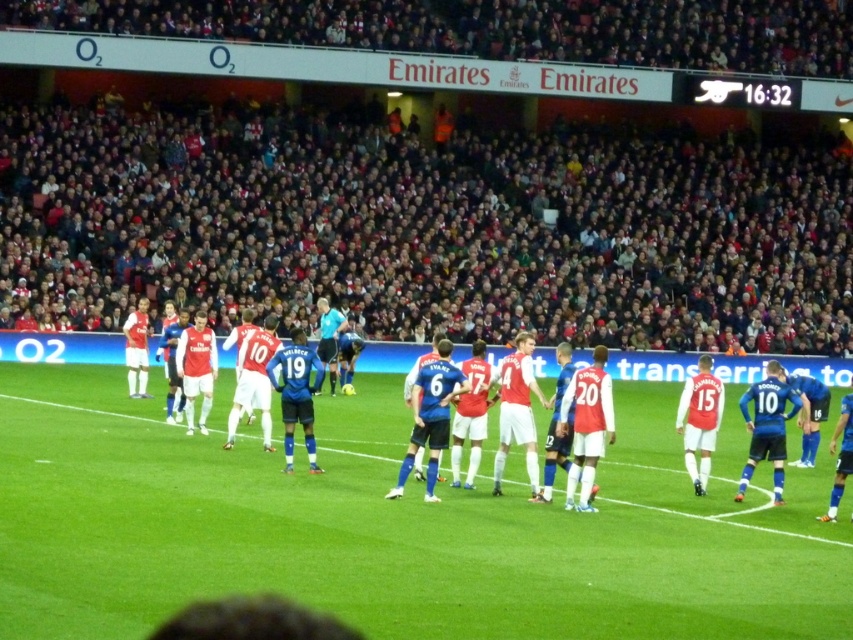
Question: Which of the following is the farthest from the observer?

Choices:
 (A) white jersey at center
 (B) green grass football field at center

Answer: (A)

Question: Is green grass football field at center behind white jersey at center?

Choices:
 (A) no
 (B) yes

Answer: (A)

Question: Is green grass football field at center behind white jersey at center?

Choices:
 (A) yes
 (B) no

Answer: (B)

Question: Is green grass football field at center above white jersey at center?

Choices:
 (A) no
 (B) yes

Answer: (A)

Question: Which of the following is the closest to the observer?

Choices:
 (A) (149, 564)
 (B) (479, 342)

Answer: (A)